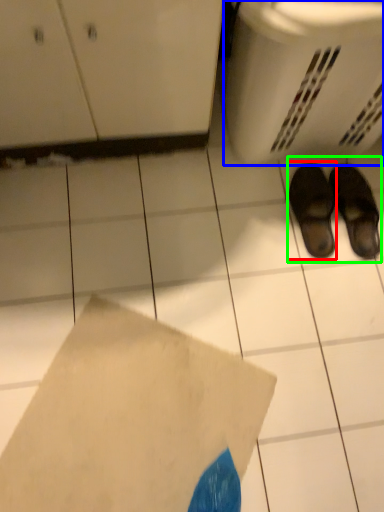
Question: Which is nearer to the footwear (highlighted by a red box)? basket (highlighted by a blue box) or footwear (highlighted by a green box).

Choices:
 (A) basket
 (B) footwear

Answer: (B)